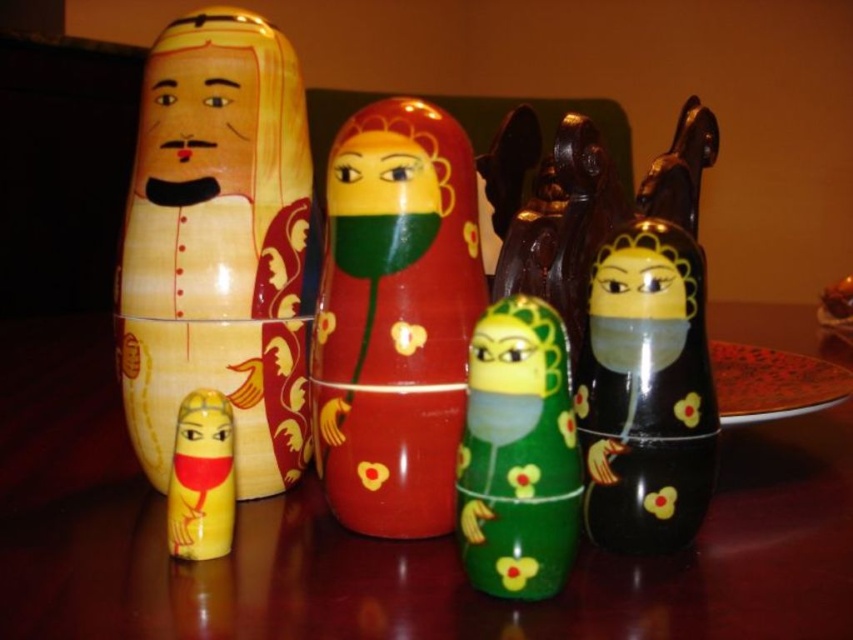
Is point (250, 628) closer to viewer compared to point (654, 305)?

Yes, point (250, 628) is in front of point (654, 305).

Which is behind, point (836, 554) or point (676, 316)?

Positioned behind is point (836, 554).

Where is `glossy wooden table at center`? The height and width of the screenshot is (640, 853). glossy wooden table at center is located at coordinates (380, 540).

Is shiny red wood nesting doll at center to the left of matte yellow face at center from the viewer's perspective?

Yes, shiny red wood nesting doll at center is to the left of matte yellow face at center.

Is shiny red wood nesting doll at center smaller than matte yellow face at center?

Actually, shiny red wood nesting doll at center might be larger than matte yellow face at center.

Is point (335, 262) farther from viewer compared to point (498, 381)?

Yes, point (335, 262) is farther from viewer.

Identify the location of shiny red wood nesting doll at center. (395, 317).

Is wooden doll at left positioned in front of matte yellow face at center?

No, it is not.

Is wooden doll at left above matte yellow face at center?

Yes.

Which is in front, point (213, 310) or point (495, 342)?

Point (495, 342) is in front.

Find the location of a particular element. wooden doll at left is located at coordinates (218, 246).